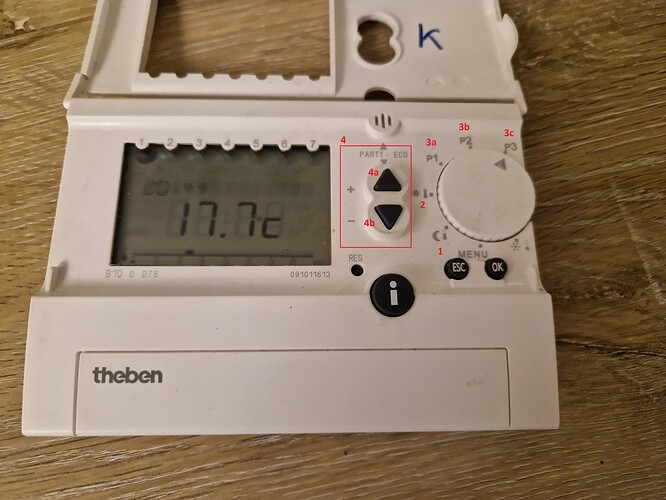
The width and height of the screenshot is (666, 500). I want to click on wall mountable thermostast, so click(x=521, y=324).